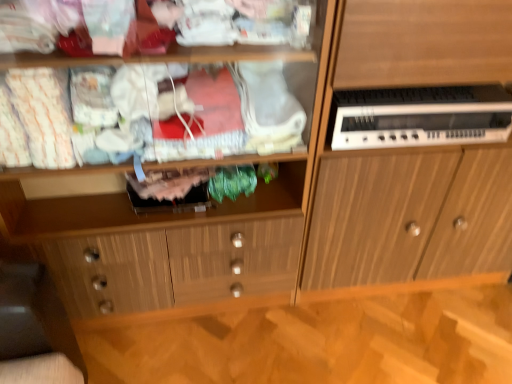
Question: Is wooden cabinet at right positioned before white plastic electronic device at right?

Choices:
 (A) yes
 (B) no

Answer: (A)

Question: From the image's perspective, is wooden cabinet at right under white plastic electronic device at right?

Choices:
 (A) no
 (B) yes

Answer: (B)

Question: Does wooden cabinet at right have a greater width compared to white plastic electronic device at right?

Choices:
 (A) no
 (B) yes

Answer: (B)

Question: Is wooden cabinet at right touching white plastic electronic device at right?

Choices:
 (A) yes
 (B) no

Answer: (B)

Question: Does wooden cabinet at right have a greater height compared to white plastic electronic device at right?

Choices:
 (A) no
 (B) yes

Answer: (B)

Question: Considering the positions of wooden cabinet at center and white plastic electronic device at right in the image, is wooden cabinet at center wider or thinner than white plastic electronic device at right?

Choices:
 (A) thin
 (B) wide

Answer: (B)

Question: From the image's perspective, is wooden cabinet at center above or below white plastic electronic device at right?

Choices:
 (A) below
 (B) above

Answer: (A)

Question: Is wooden cabinet at center spatially inside white plastic electronic device at right, or outside of it?

Choices:
 (A) inside
 (B) outside

Answer: (B)

Question: From a real-world perspective, is wooden cabinet at center above or below white plastic electronic device at right?

Choices:
 (A) below
 (B) above

Answer: (A)

Question: From the image's perspective, is wooden cabinet at right above or below wooden cabinet at center?

Choices:
 (A) below
 (B) above

Answer: (B)

Question: Is wooden cabinet at right situated inside wooden cabinet at center or outside?

Choices:
 (A) inside
 (B) outside

Answer: (B)

Question: Looking at their shapes, would you say wooden cabinet at right is wider or thinner than wooden cabinet at center?

Choices:
 (A) wide
 (B) thin

Answer: (A)

Question: Relative to wooden cabinet at center, is wooden cabinet at right in front or behind?

Choices:
 (A) behind
 (B) front

Answer: (A)

Question: Based on their sizes in the image, would you say wooden cabinet at right is bigger or smaller than white plastic electronic device at right?

Choices:
 (A) small
 (B) big

Answer: (B)

Question: Is wooden cabinet at right wider or thinner than white plastic electronic device at right?

Choices:
 (A) wide
 (B) thin

Answer: (A)